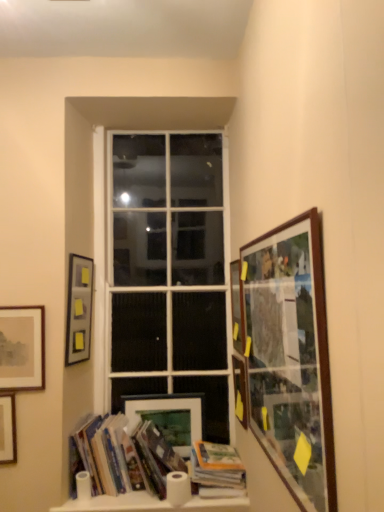
Where is `blank space situated above hardcover book at lower center, the first book when ordered from right to left (from a real-world perspective)`? This screenshot has height=512, width=384. blank space situated above hardcover book at lower center, the first book when ordered from right to left (from a real-world perspective) is located at coordinates (215, 448).